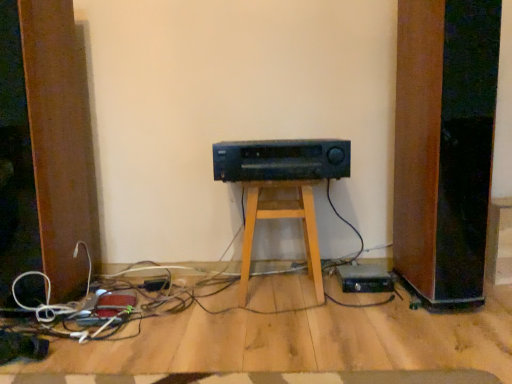
Describe the element at coordinates (281, 160) in the screenshot. The image size is (512, 384). I see `black plastic amplifier at center` at that location.

At what (x,y) coordinates should I click in order to perform the action: click on black plastic amplifier at center. Please return your answer as a coordinate pair (x, y). This screenshot has height=384, width=512. Looking at the image, I should click on (281, 160).

What is the approximate width of black plastic amplifier at center?

black plastic amplifier at center is 13.23 inches wide.

At what (x,y) coordinates should I click in order to perform the action: click on wooden stool at center. Please return your answer as a coordinate pair (x, y). The height and width of the screenshot is (384, 512). Looking at the image, I should click on click(279, 218).

Describe the element at coordinates (279, 218) in the screenshot. I see `wooden stool at center` at that location.

What is the approximate width of wooden stool at center?

wooden stool at center is 12.41 inches in width.

Identify the location of black plastic amplifier at center. (281, 160).

In the image, is wooden stool at center on the left side or the right side of black plastic amplifier at center?

wooden stool at center is to the left of black plastic amplifier at center.

In the image, is wooden stool at center positioned in front of or behind black plastic amplifier at center?

wooden stool at center is positioned farther from the viewer than black plastic amplifier at center.

Which is nearer, (246, 297) or (216, 179)?

The point (216, 179) is closer.

From the image's perspective, would you say wooden stool at center is shown under black plastic amplifier at center?

Yes, from the image's perspective, wooden stool at center is below black plastic amplifier at center.

From the picture: From a real-world perspective, which object rests below the other?

wooden stool at center is physically lower.

Is wooden stool at center thinner than black plastic amplifier at center?

Correct, the width of wooden stool at center is less than that of black plastic amplifier at center.

Considering the relative sizes of wooden stool at center and black plastic amplifier at center in the image provided, is wooden stool at center shorter than black plastic amplifier at center?

No.

Which of these two, wooden stool at center or black plastic amplifier at center, is bigger?

wooden stool at center.

Is wooden stool at center not within black plastic amplifier at center?

wooden stool at center is positioned outside black plastic amplifier at center.

Is there a large distance between wooden stool at center and black plastic amplifier at center?

No, wooden stool at center is in close proximity to black plastic amplifier at center.

Is wooden stool at center positioned with its back to black plastic amplifier at center?

wooden stool at center is not turned away from black plastic amplifier at center.

How many degrees apart are the facing directions of wooden stool at center and black plastic amplifier at center?

The facing directions of wooden stool at center and black plastic amplifier at center are 1.75 degrees apart.

Measure the distance from wooden stool at center to black plastic amplifier at center.

A distance of 6.88 inches exists between wooden stool at center and black plastic amplifier at center.

At what (x,y) coordinates should I click in order to perform the action: click on furniture that is below the black plastic amplifier at center (from the image's perspective). Please return your answer as a coordinate pair (x, y). The width and height of the screenshot is (512, 384). Looking at the image, I should click on (279, 218).

Can you confirm if black plastic amplifier at center is positioned to the left of wooden stool at center?

No.

Is black plastic amplifier at center further to the viewer compared to wooden stool at center?

Result: No, black plastic amplifier at center is closer to the camera.

Which is less distant, (243,155) or (276,182)?

The point (243,155) is closer.

From the image's perspective, is black plastic amplifier at center under wooden stool at center?

Actually, black plastic amplifier at center appears above wooden stool at center in the image.

From a real-world perspective, is black plastic amplifier at center under wooden stool at center?

No, from a real-world perspective, black plastic amplifier at center is not beneath wooden stool at center.

Which object is wider, black plastic amplifier at center or wooden stool at center?

Wider between the two is black plastic amplifier at center.

Between black plastic amplifier at center and wooden stool at center, which one has less height?

With less height is black plastic amplifier at center.

Looking at the image, does black plastic amplifier at center seem bigger or smaller compared to wooden stool at center?

black plastic amplifier at center is smaller than wooden stool at center.

Is black plastic amplifier at center spatially inside wooden stool at center, or outside of it?

black plastic amplifier at center is not enclosed by wooden stool at center.

Does black plastic amplifier at center touch wooden stool at center?

black plastic amplifier at center is not next to wooden stool at center, and they're not touching.

Does black plastic amplifier at center turn towards wooden stool at center?

No, black plastic amplifier at center is not turned towards wooden stool at center.

The width and height of the screenshot is (512, 384). I want to click on furniture below the black plastic amplifier at center (from the image's perspective), so click(x=279, y=218).

At what (x,y) coordinates should I click in order to perform the action: click on furniture that is below the black plastic amplifier at center (from the image's perspective). Please return your answer as a coordinate pair (x, y). The height and width of the screenshot is (384, 512). Looking at the image, I should click on (279, 218).

In order to click on amplifier in front of the wooden stool at center in this screenshot , I will do `click(281, 160)`.